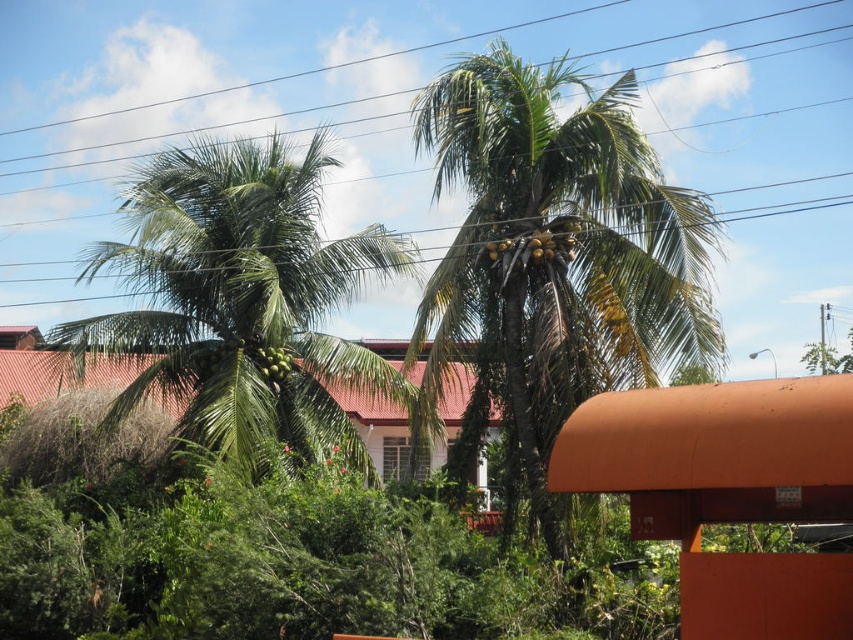
Which is more to the left, green leafy palm at center or green leafy coconut tree at left?

Positioned to the left is green leafy coconut tree at left.

The height and width of the screenshot is (640, 853). What do you see at coordinates (556, 250) in the screenshot?
I see `green leafy palm at center` at bounding box center [556, 250].

Image resolution: width=853 pixels, height=640 pixels. Identify the location of green leafy palm at center. (556, 250).

The width and height of the screenshot is (853, 640). I want to click on green leafy palm at center, so click(556, 250).

Which is more to the right, metallic wire at upper center or green leafy coconut tree at left?

Positioned to the right is metallic wire at upper center.

Is metallic wire at upper center closer to the viewer compared to green leafy coconut tree at left?

No, metallic wire at upper center is further to the viewer.

Between point (790, 195) and point (258, 307), which one is positioned behind?

Point (790, 195)

Identify the location of metallic wire at upper center. (410, 124).

What are the coordinates of `metallic wire at upper center` in the screenshot? It's located at (410, 124).

Is metallic wire at upper center behind green leafy palm at center?

Yes, metallic wire at upper center is behind green leafy palm at center.

Between point (190, 60) and point (485, 58), which one is positioned in front?

Positioned in front is point (485, 58).

The width and height of the screenshot is (853, 640). Identify the location of metallic wire at upper center. (410, 124).